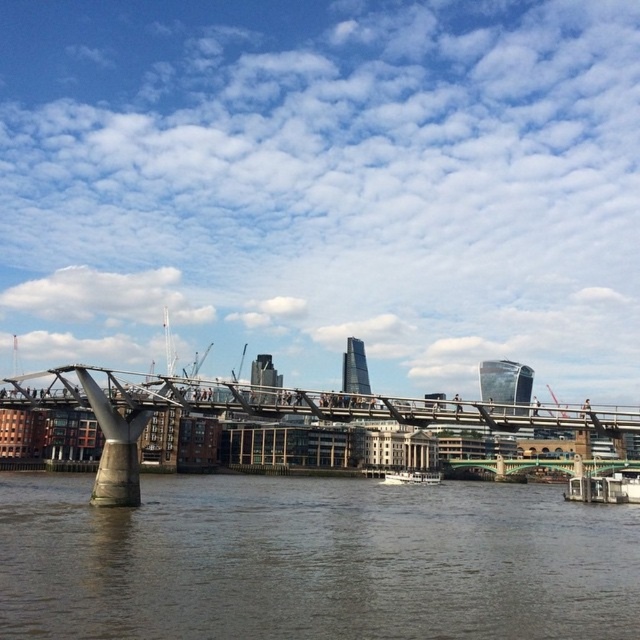
Question: Is the position of brown concrete water at lower center more distant than that of white wooden boat at lower center?

Choices:
 (A) yes
 (B) no

Answer: (B)

Question: Which is farther from the brown concrete water at lower center?

Choices:
 (A) metallic gray bridge at center
 (B) white wooden boat at lower center

Answer: (B)

Question: Which point is closer to the camera?

Choices:
 (A) metallic gray bridge at center
 (B) brown concrete water at lower center
 (C) white wooden boat at lower center

Answer: (B)

Question: Is metallic gray bridge at center bigger than white wooden boat at lower center?

Choices:
 (A) no
 (B) yes

Answer: (B)

Question: Does brown concrete water at lower center have a smaller size compared to metallic gray bridge at center?

Choices:
 (A) no
 (B) yes

Answer: (B)

Question: Among these points, which one is nearest to the camera?

Choices:
 (A) (388, 476)
 (B) (113, 435)
 (C) (403, 556)

Answer: (C)